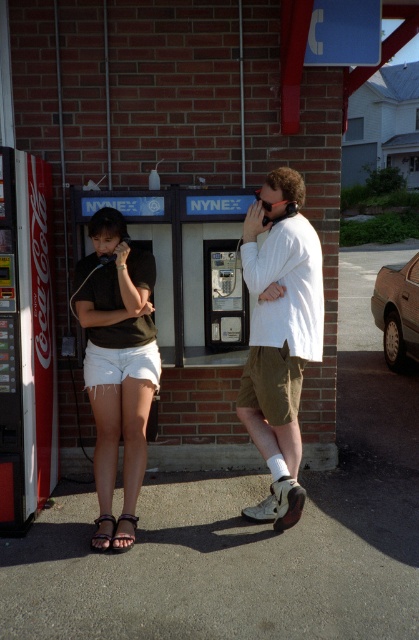
Is point (263, 208) farther from viewer compared to point (98, 538)?

Yes, point (263, 208) is behind point (98, 538).

Can you confirm if white cotton shirt at center is positioned to the right of brown leather sandal at lower left?

Yes, white cotton shirt at center is to the right of brown leather sandal at lower left.

What are the coordinates of `white cotton shirt at center` in the screenshot? It's located at (279, 337).

Between point (118, 548) and point (106, 518), which one is positioned behind?

The point (106, 518) is more distant.

Is black leather sandal at lower left further to the viewer compared to brown leather sandal at lower left?

No, it is not.

Locate an element on the screen. This screenshot has width=419, height=640. black leather sandal at lower left is located at coordinates (123, 545).

Where is `black leather sandal at lower left`? This screenshot has width=419, height=640. black leather sandal at lower left is located at coordinates (123, 545).

Is white cotton shorts at center taller than brown leather sandal at lower left?

Yes, white cotton shorts at center is taller than brown leather sandal at lower left.

Image resolution: width=419 pixels, height=640 pixels. What do you see at coordinates (279, 333) in the screenshot?
I see `white cotton shorts at center` at bounding box center [279, 333].

Does point (286, 204) lie behind point (108, 545)?

Yes, point (286, 204) is behind point (108, 545).

Locate an element on the screen. The image size is (419, 640). white cotton shorts at center is located at coordinates (279, 333).